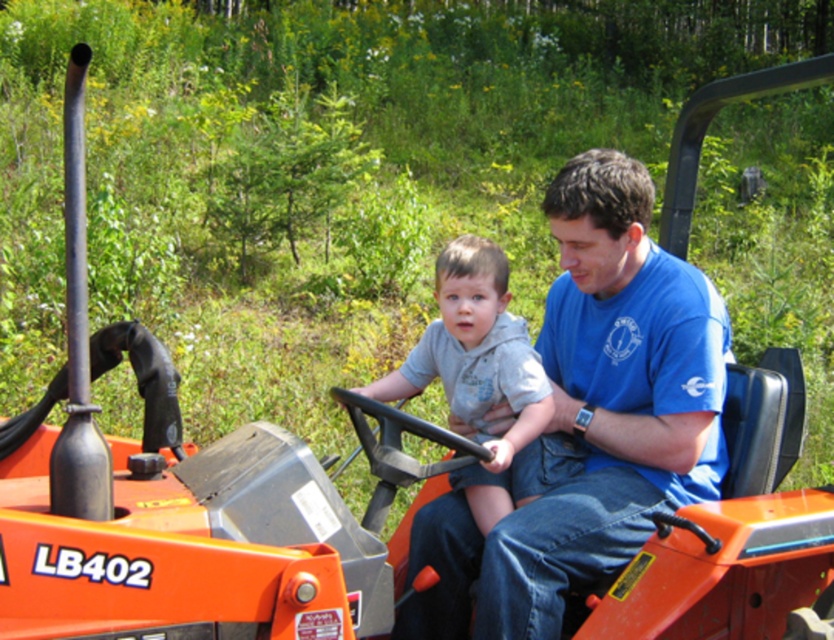
Which is below, blue cotton shirt at center or gray soft hoodie at center?

blue cotton shirt at center is below.

Can you confirm if blue cotton shirt at center is positioned below gray soft hoodie at center?

Correct, blue cotton shirt at center is located below gray soft hoodie at center.

The height and width of the screenshot is (640, 834). Describe the element at coordinates (591, 419) in the screenshot. I see `blue cotton shirt at center` at that location.

Locate an element on the screen. This screenshot has height=640, width=834. blue cotton shirt at center is located at coordinates (591, 419).